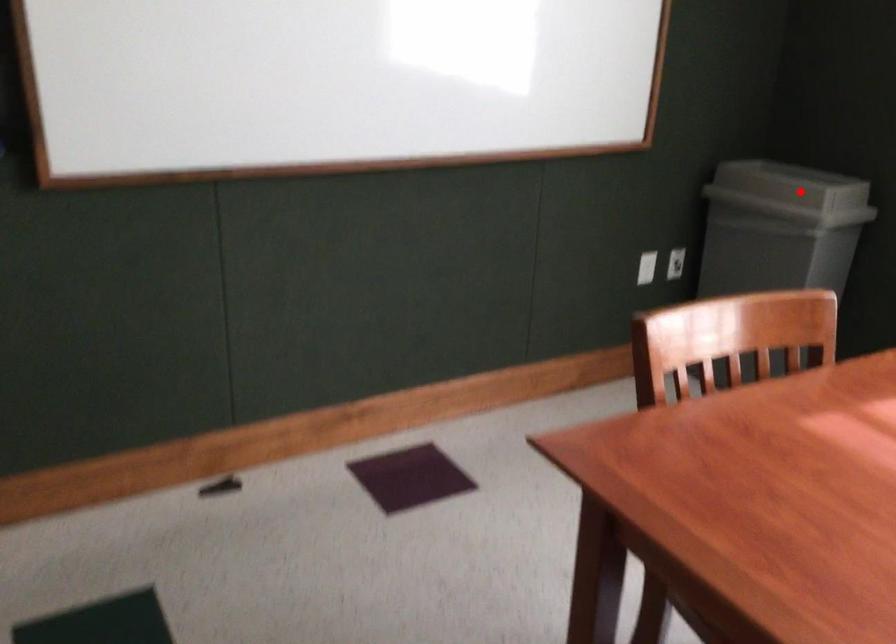
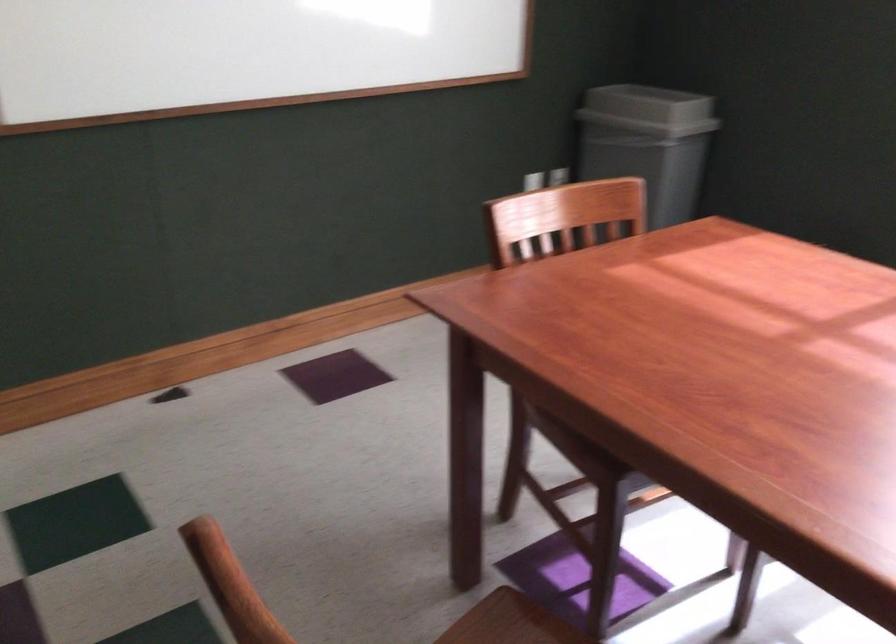
Locate, in the second image, the point that corresponds to the highlighted location in the first image.

(648, 109)